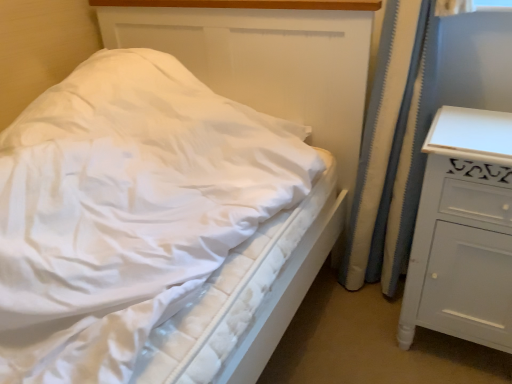
Question: Does white textured curtain at right touch white painted wood chest of drawers at right?

Choices:
 (A) yes
 (B) no

Answer: (B)

Question: Is white painted wood chest of drawers at right surrounded by white textured curtain at right?

Choices:
 (A) no
 (B) yes

Answer: (A)

Question: Would you consider white textured curtain at right to be distant from white painted wood chest of drawers at right?

Choices:
 (A) yes
 (B) no

Answer: (B)

Question: From the image's perspective, is white textured curtain at right over white painted wood chest of drawers at right?

Choices:
 (A) yes
 (B) no

Answer: (A)

Question: From the image's perspective, does white textured curtain at right appear lower than white painted wood chest of drawers at right?

Choices:
 (A) no
 (B) yes

Answer: (A)

Question: Does white textured curtain at right come behind white painted wood chest of drawers at right?

Choices:
 (A) no
 (B) yes

Answer: (B)

Question: Is white painted wood chest of drawers at right to the right of white quilted mattress at center from the viewer's perspective?

Choices:
 (A) no
 (B) yes

Answer: (B)

Question: Does white painted wood chest of drawers at right have a lesser width compared to white quilted mattress at center?

Choices:
 (A) yes
 (B) no

Answer: (A)

Question: Is white painted wood chest of drawers at right next to white quilted mattress at center?

Choices:
 (A) yes
 (B) no

Answer: (B)

Question: Considering the relative sizes of white painted wood chest of drawers at right and white quilted mattress at center in the image provided, is white painted wood chest of drawers at right taller than white quilted mattress at center?

Choices:
 (A) yes
 (B) no

Answer: (B)

Question: From the image's perspective, does white painted wood chest of drawers at right appear lower than white quilted mattress at center?

Choices:
 (A) no
 (B) yes

Answer: (B)

Question: Is white painted wood chest of drawers at right at the left side of white quilted mattress at center?

Choices:
 (A) no
 (B) yes

Answer: (A)

Question: Is white quilted mattress at center located within white textured curtain at right?

Choices:
 (A) no
 (B) yes

Answer: (A)